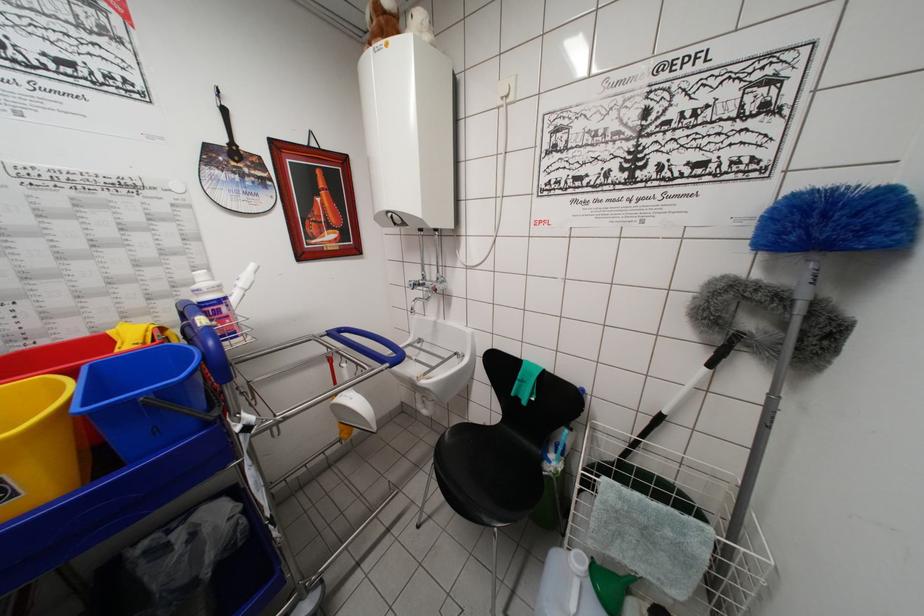
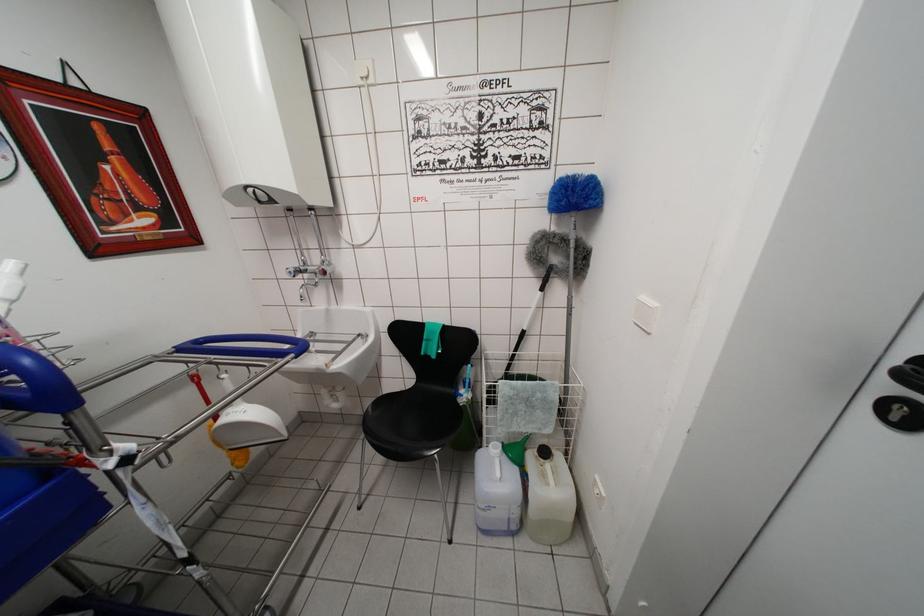
Where in the second image is the point corresponding to point (211, 331) from the first image?

(5, 349)